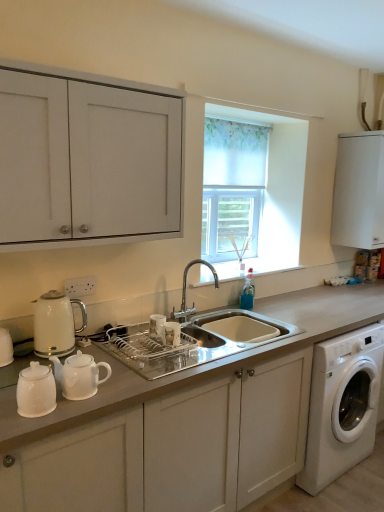
Question: From the image's perspective, is white glossy electric kettle at left above white matte cabinet at upper right, acting as the third cabinetry starting from the bottom?

Choices:
 (A) yes
 (B) no

Answer: (B)

Question: From the image's perspective, is white glossy electric kettle at left beneath white matte cabinet at upper right, which ranks as the first cabinetry in right-to-left order?

Choices:
 (A) no
 (B) yes

Answer: (B)

Question: From a real-world perspective, is white glossy electric kettle at left physically above white matte cabinet at upper right, which appears as the first cabinetry when viewed from the top?

Choices:
 (A) yes
 (B) no

Answer: (B)

Question: Is white glossy electric kettle at left looking in the opposite direction of white matte cabinet at upper right, which appears as the first cabinetry when viewed from the top?

Choices:
 (A) no
 (B) yes

Answer: (A)

Question: Can you confirm if white glossy electric kettle at left is bigger than white matte cabinet at upper right, arranged as the third cabinetry when viewed from the left?

Choices:
 (A) no
 (B) yes

Answer: (A)

Question: Considering the positions of white matte cabinet at upper right, which appears as the first cabinetry when viewed from the top, and polished chrome faucet at center in the image, is white matte cabinet at upper right, which appears as the first cabinetry when viewed from the top, wider or thinner than polished chrome faucet at center?

Choices:
 (A) wide
 (B) thin

Answer: (A)

Question: Based on their positions, is white matte cabinet at upper right, which appears as the first cabinetry when viewed from the top, located to the left or right of polished chrome faucet at center?

Choices:
 (A) left
 (B) right

Answer: (B)

Question: Does point (374, 174) appear closer or farther from the camera than point (177, 310)?

Choices:
 (A) closer
 (B) farther

Answer: (B)

Question: From the image's perspective, is white matte cabinet at upper right, arranged as the third cabinetry when viewed from the left, above or below polished chrome faucet at center?

Choices:
 (A) below
 (B) above

Answer: (B)

Question: Is white glossy teapot at lower left wider or thinner than white matte cabinet at center, which appears as the 1th cabinetry when ordered from the bottom?

Choices:
 (A) thin
 (B) wide

Answer: (A)

Question: From the image's perspective, is white glossy teapot at lower left above or below white matte cabinet at center, placed as the third cabinetry when sorted from top to bottom?

Choices:
 (A) above
 (B) below

Answer: (A)

Question: Would you say white glossy teapot at lower left is to the left or to the right of white matte cabinet at center, which appears as the 1th cabinetry when ordered from the bottom, in the picture?

Choices:
 (A) left
 (B) right

Answer: (A)

Question: Looking at the image, does white glossy teapot at lower left seem bigger or smaller compared to white matte cabinet at center, the 2th cabinetry when ordered from right to left?

Choices:
 (A) small
 (B) big

Answer: (A)

Question: From a real-world perspective, is clear plastic dish at center positioned above or below translucent fabric at center?

Choices:
 (A) above
 (B) below

Answer: (B)

Question: Is clear plastic dish at center inside or outside of translucent fabric at center?

Choices:
 (A) outside
 (B) inside

Answer: (A)